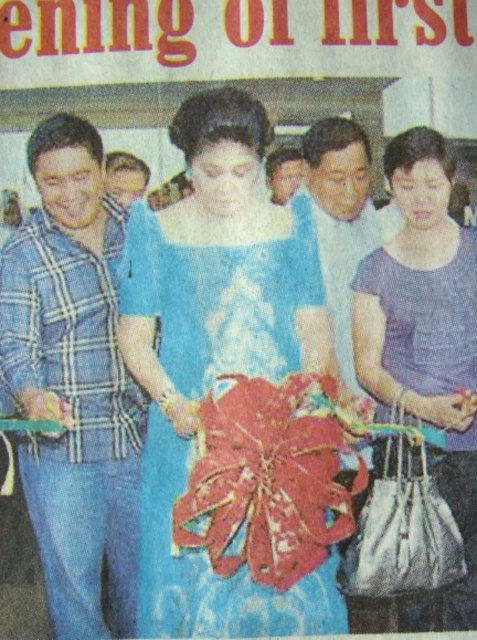
Question: Observing the image, what is the correct spatial positioning of blue plaid shirt at left in reference to matte blue shirt at center?

Choices:
 (A) left
 (B) right

Answer: (A)

Question: Which object is farther from the camera taking this photo?

Choices:
 (A) blue plaid shirt at left
 (B) blue satin dress at center
 (C) matte blue shirt at center
 (D) matte purple dress at right

Answer: (C)

Question: Which of the following is the farthest from the observer?

Choices:
 (A) (72, 547)
 (B) (140, 356)

Answer: (B)

Question: Does matte purple dress at right come in front of matte blue shirt at center?

Choices:
 (A) yes
 (B) no

Answer: (A)

Question: Among these points, which one is farthest from the camera?

Choices:
 (A) (24, 284)
 (B) (462, 612)
 (C) (351, 368)

Answer: (C)

Question: Does matte purple dress at right appear on the right side of matte blue shirt at center?

Choices:
 (A) no
 (B) yes

Answer: (B)